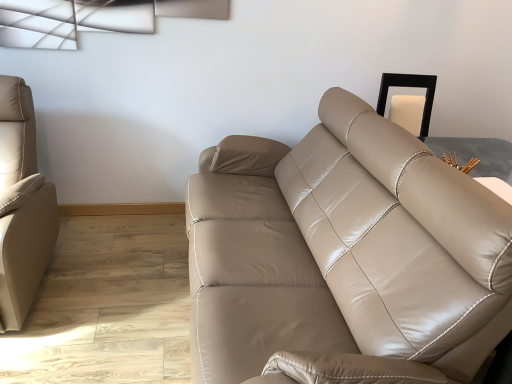
Question: Would you consider beige leather couch at left, marked as the 2th studio couch in a right-to-left arrangement, to be distant from matte leather couch at center, which ranks as the first studio couch in right-to-left order?

Choices:
 (A) no
 (B) yes

Answer: (B)

Question: Is beige leather couch at left, the 1th studio couch when ordered from left to right, next to matte leather couch at center, which ranks as the 2th studio couch in left-to-right order?

Choices:
 (A) yes
 (B) no

Answer: (B)

Question: Does beige leather couch at left, marked as the 2th studio couch in a right-to-left arrangement, come behind matte leather couch at center, which ranks as the 2th studio couch in left-to-right order?

Choices:
 (A) yes
 (B) no

Answer: (A)

Question: Considering the relative positions of beige leather couch at left, marked as the 2th studio couch in a right-to-left arrangement, and matte leather couch at center, which ranks as the first studio couch in right-to-left order, in the image provided, is beige leather couch at left, marked as the 2th studio couch in a right-to-left arrangement, to the left of matte leather couch at center, which ranks as the first studio couch in right-to-left order, from the viewer's perspective?

Choices:
 (A) no
 (B) yes

Answer: (B)

Question: Can you confirm if beige leather couch at left, marked as the 2th studio couch in a right-to-left arrangement, is thinner than matte leather couch at center, which ranks as the first studio couch in right-to-left order?

Choices:
 (A) no
 (B) yes

Answer: (B)

Question: Considering the relative sizes of beige leather couch at left, marked as the 2th studio couch in a right-to-left arrangement, and matte leather couch at center, which ranks as the 2th studio couch in left-to-right order, in the image provided, is beige leather couch at left, marked as the 2th studio couch in a right-to-left arrangement, taller than matte leather couch at center, which ranks as the 2th studio couch in left-to-right order,?

Choices:
 (A) yes
 (B) no

Answer: (A)

Question: From a real-world perspective, is matte leather couch at center, which ranks as the first studio couch in right-to-left order, located higher than beige leather couch at left, the 1th studio couch when ordered from left to right?

Choices:
 (A) yes
 (B) no

Answer: (A)

Question: Is the depth of matte leather couch at center, which ranks as the first studio couch in right-to-left order, greater than that of beige leather couch at left, marked as the 2th studio couch in a right-to-left arrangement?

Choices:
 (A) no
 (B) yes

Answer: (A)

Question: Is matte leather couch at center, which ranks as the 2th studio couch in left-to-right order, shorter than beige leather couch at left, the 1th studio couch when ordered from left to right?

Choices:
 (A) no
 (B) yes

Answer: (B)

Question: Is matte leather couch at center, which ranks as the first studio couch in right-to-left order, bigger than beige leather couch at left, marked as the 2th studio couch in a right-to-left arrangement?

Choices:
 (A) yes
 (B) no

Answer: (A)

Question: Is matte leather couch at center, which ranks as the first studio couch in right-to-left order, thinner than beige leather couch at left, marked as the 2th studio couch in a right-to-left arrangement?

Choices:
 (A) yes
 (B) no

Answer: (B)

Question: Does matte leather couch at center, which ranks as the first studio couch in right-to-left order, have a greater width compared to beige leather couch at left, the 1th studio couch when ordered from left to right?

Choices:
 (A) yes
 (B) no

Answer: (A)

Question: Considering the positions of beige leather couch at left, marked as the 2th studio couch in a right-to-left arrangement, and matte leather couch at center, which ranks as the first studio couch in right-to-left order, in the image, is beige leather couch at left, marked as the 2th studio couch in a right-to-left arrangement, bigger or smaller than matte leather couch at center, which ranks as the first studio couch in right-to-left order,?

Choices:
 (A) big
 (B) small

Answer: (B)